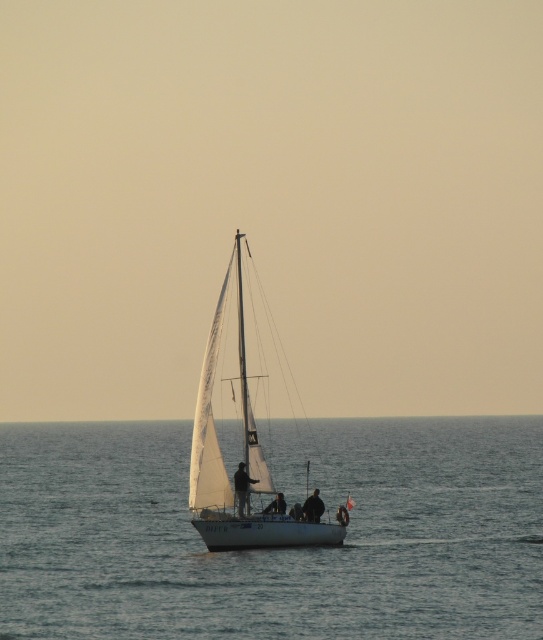
Looking at this image, is clear blue water at center further to camera compared to silhouette figure at center?

No, clear blue water at center is in front of silhouette figure at center.

Who is positioned more to the right, clear blue water at center or silhouette figure at center?

clear blue water at center is more to the right.

I want to click on clear blue water at center, so point(275,548).

Where is `clear blue water at center`? The height and width of the screenshot is (640, 543). clear blue water at center is located at coordinates (275, 548).

Who is lower down, silhouette figure at center or dark fabric jacket at center?

dark fabric jacket at center is below.

Which is in front, point (243, 500) or point (306, 500)?

Point (243, 500)

Does point (237, 476) lie behind point (318, 512)?

No, (237, 476) is closer to viewer.

Image resolution: width=543 pixels, height=640 pixels. Identify the location of silhouette figure at center. (242, 486).

Can you confirm if clear blue water at center is bigger than white sailboat at center?

Yes, clear blue water at center is bigger than white sailboat at center.

Does clear blue water at center have a greater width compared to white sailboat at center?

Yes.

Which is behind, point (520, 474) or point (239, 273)?

Point (520, 474)

The width and height of the screenshot is (543, 640). Find the location of `clear blue water at center`. clear blue water at center is located at coordinates (275, 548).